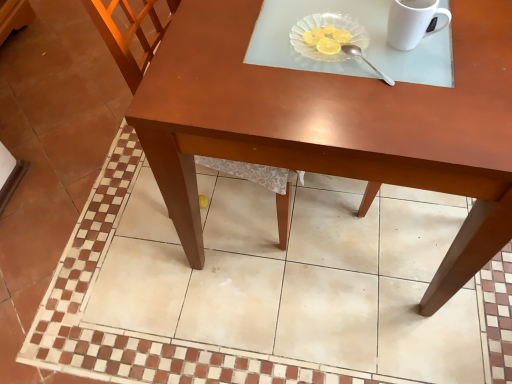
Locate an element on the screen. blank space to the left of transparent glass plate at upper center is located at coordinates (240, 47).